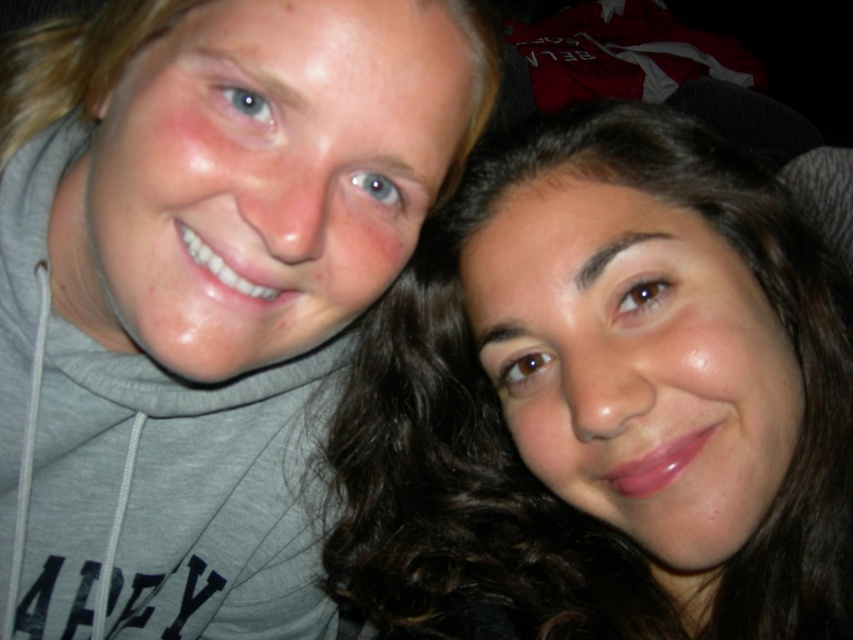
Question: Does matte gray hoodie at upper left appear on the left side of smooth brown hair at center?

Choices:
 (A) no
 (B) yes

Answer: (B)

Question: Does matte gray hoodie at upper left appear over smooth brown hair at center?

Choices:
 (A) no
 (B) yes

Answer: (B)

Question: Which point is closer to the camera taking this photo?

Choices:
 (A) (415, 406)
 (B) (51, 618)

Answer: (A)

Question: Can you confirm if matte gray hoodie at upper left is positioned below smooth brown hair at center?

Choices:
 (A) no
 (B) yes

Answer: (A)

Question: Which object is closer to the camera taking this photo?

Choices:
 (A) matte gray hoodie at upper left
 (B) smooth brown hair at center

Answer: (A)

Question: Which point is closer to the camera?

Choices:
 (A) matte gray hoodie at upper left
 (B) smooth brown hair at center

Answer: (A)